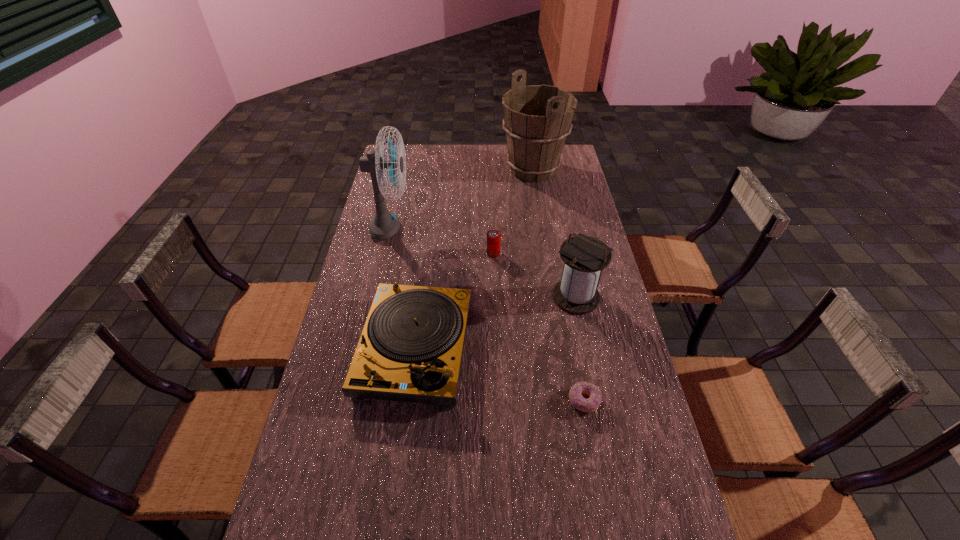
Find the location of `blank area located on the right of the third shortest object`. blank area located on the right of the third shortest object is located at coordinates (588, 349).

You are a GUI agent. You are given a task and a screenshot of the screen. Output one action in this format:
    pyautogui.click(x=<x>, y=<y>)
    Task: Click on the free space located on the back of the can
    Image resolution: width=960 pixels, height=540 pixels.
    Given the screenshot: What is the action you would take?
    pyautogui.click(x=492, y=224)

Identify the location of free space located on the back of the doughnut. (578, 366).

At what (x,y) coordinates should I click in order to perform the action: click on object located at the far edge. Please return your answer as a coordinate pair (x, y). The width and height of the screenshot is (960, 540). Looking at the image, I should click on (537, 119).

Image resolution: width=960 pixels, height=540 pixels. In order to click on fan that is at the left edge in this screenshot , I will do `click(384, 224)`.

Locate an element on the screen. The image size is (960, 540). record player located at the left edge is located at coordinates (410, 350).

You are a GUI agent. You are given a task and a screenshot of the screen. Output one action in this format:
    pyautogui.click(x=<x>, y=<y>)
    Task: Click on the bucket that is at the right edge
    
    Given the screenshot: What is the action you would take?
    pyautogui.click(x=537, y=119)

Image resolution: width=960 pixels, height=540 pixels. In order to click on lantern at the right edge in this screenshot , I will do `click(584, 257)`.

Where is `doughnut present at the right edge`? This screenshot has height=540, width=960. doughnut present at the right edge is located at coordinates (591, 404).

The image size is (960, 540). Find the location of `object located in the far right corner section of the desktop`. object located in the far right corner section of the desktop is located at coordinates (537, 119).